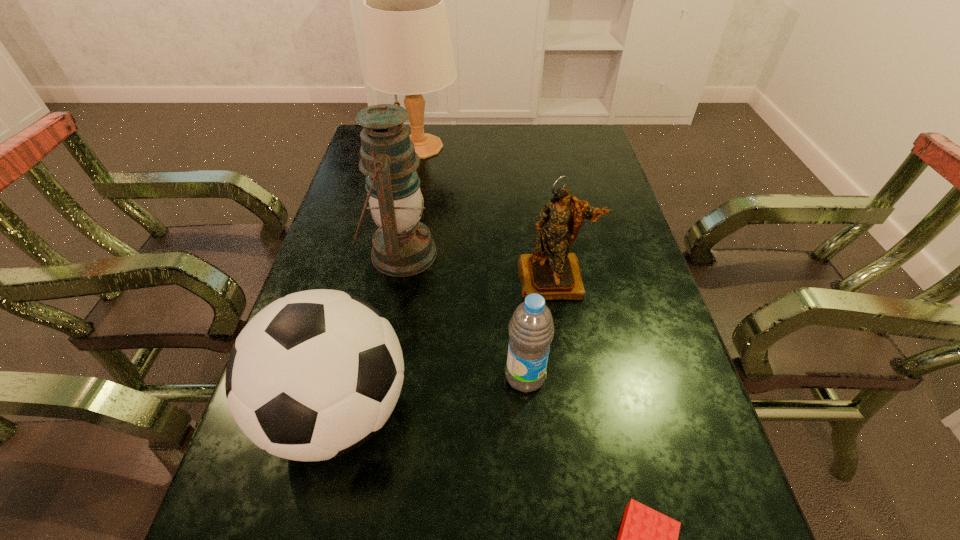
Find the location of `object present at the far edge`. object present at the far edge is located at coordinates (408, 50).

Locate an element on the screen. table lamp present at the left edge is located at coordinates (408, 50).

Where is `oil lamp located in the left edge section of the desktop`? The width and height of the screenshot is (960, 540). oil lamp located in the left edge section of the desktop is located at coordinates (402, 246).

This screenshot has height=540, width=960. What are the coordinates of `soccer ball at the left edge` in the screenshot? It's located at (315, 374).

Where is `object located at the right edge`? object located at the right edge is located at coordinates (551, 271).

The width and height of the screenshot is (960, 540). I want to click on object present at the far left corner, so click(408, 50).

I want to click on vacant space at the far edge, so click(449, 148).

Find the location of `free spot at the left edge of the desktop`. free spot at the left edge of the desktop is located at coordinates (332, 288).

The height and width of the screenshot is (540, 960). In the image, there is a desktop. Identify the location of vacant space at the right edge. (585, 191).

Locate an element on the screen. free space at the far right corner is located at coordinates (554, 144).